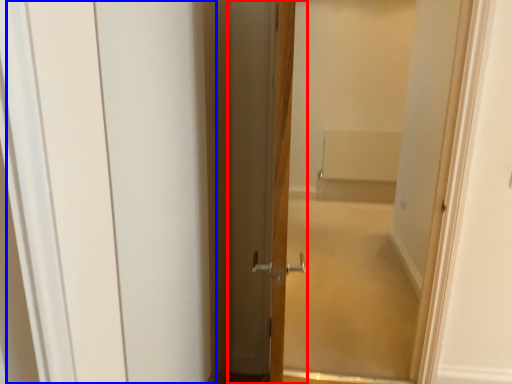
Question: Among these objects, which one is farthest to the camera, door (highlighted by a red box) or barn door (highlighted by a blue box)?

Choices:
 (A) door
 (B) barn door

Answer: (A)